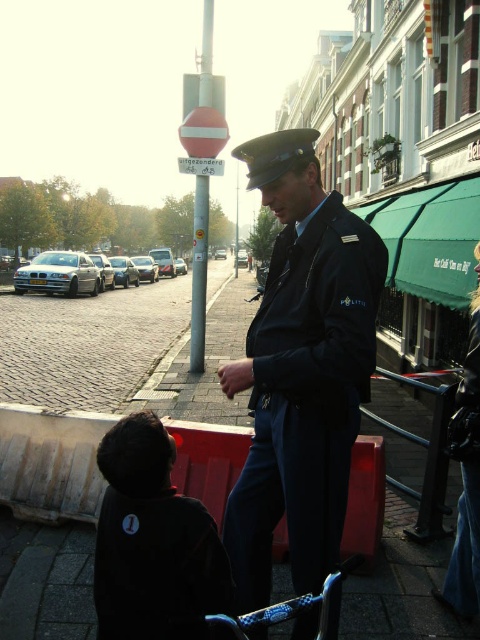
Consider the image. You are standing at the center of the street and want to find the dark blue uniform at center. In which direction should you look relative to your position?

The dark blue uniform at center is located at the center of the image, so you should look straight ahead to find it.

You are a delivery person trying to navigate through the street. You see the black matte jacket at lower left and the cobblestone pavement at lower left. Which object is positioned to the right of the other?

The black matte jacket at lower left is to the right of the cobblestone pavement at lower left.